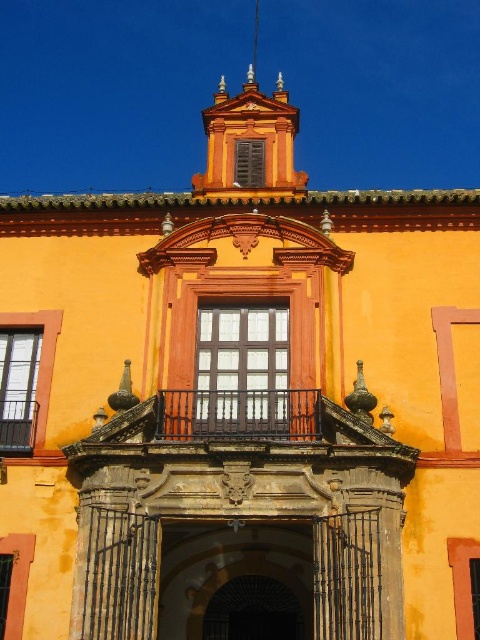
Question: Does black wrought iron balcony at center appear over dark brick archway at center?

Choices:
 (A) no
 (B) yes

Answer: (B)

Question: Among these objects, which one is farthest from the camera?

Choices:
 (A) black wrought iron balcony at center
 (B) dark brick archway at center
 (C) black wrought iron balcony at upper center

Answer: (B)

Question: Which is farther from the black wrought iron balcony at upper center?

Choices:
 (A) golden ornate gate at center
 (B) black wrought iron balcony at center
 (C) dark brick archway at center

Answer: (C)

Question: Can you confirm if golden ornate gate at center is positioned below black wrought iron balcony at upper center?

Choices:
 (A) no
 (B) yes

Answer: (B)

Question: Which object is closer to the camera taking this photo?

Choices:
 (A) black wrought iron balcony at center
 (B) golden ornate gate at center

Answer: (B)

Question: Is black wrought iron balcony at center closer to camera compared to dark brick archway at center?

Choices:
 (A) no
 (B) yes

Answer: (B)